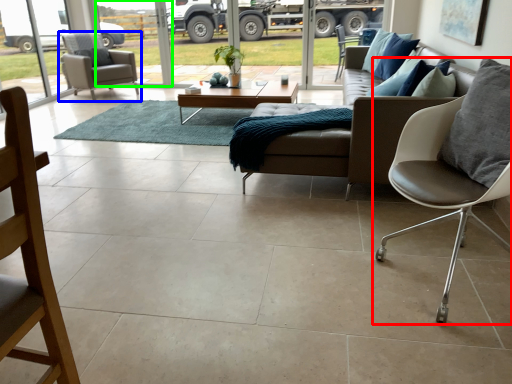
Question: Based on their relative distances, which object is nearer to chair (highlighted by a red box)? Choose from chair (highlighted by a blue box) and window screen (highlighted by a green box).

Choices:
 (A) chair
 (B) window screen

Answer: (A)